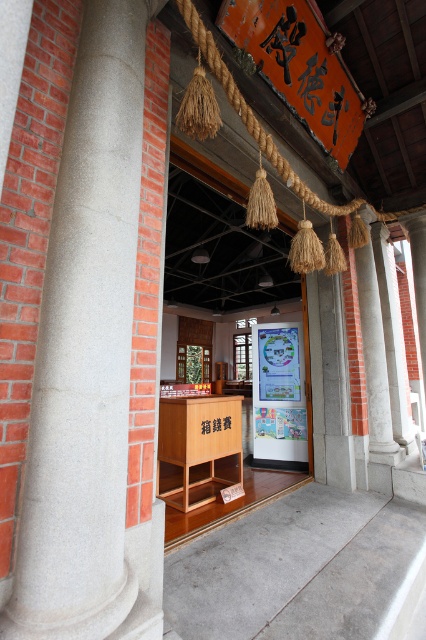
Question: Which of the following is the farthest from the observer?

Choices:
 (A) granite column at left
 (B) orange paper sign at upper center
 (C) matte plastic bulletin board at center
 (D) wooden box at center

Answer: (C)

Question: Does matte plastic bulletin board at center have a larger size compared to white marble column at center?

Choices:
 (A) no
 (B) yes

Answer: (A)

Question: From the image, what is the correct spatial relationship of matte plastic bulletin board at center in relation to white marble column at center?

Choices:
 (A) above
 (B) below

Answer: (B)

Question: Based on their relative distances, which object is farther from the granite column at left?

Choices:
 (A) wooden box at center
 (B) orange paper sign at upper center
 (C) white marble column at center

Answer: (C)

Question: Is granite column at left wider than orange paper sign at upper center?

Choices:
 (A) yes
 (B) no

Answer: (B)

Question: Which object is positioned closest to the wooden box at center?

Choices:
 (A) granite column at left
 (B) orange paper sign at upper center
 (C) matte plastic bulletin board at center

Answer: (C)